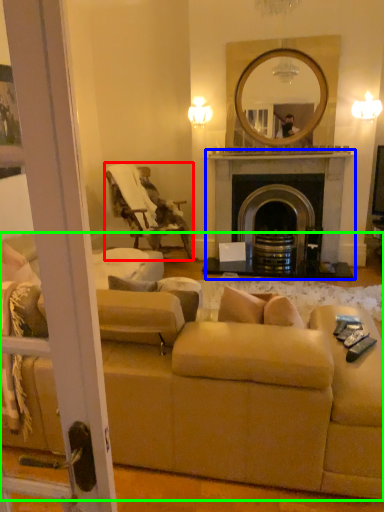
Question: Which object is positioned farthest from chair (highlighted by a red box)? Select from fireplace (highlighted by a blue box) and studio couch (highlighted by a green box).

Choices:
 (A) fireplace
 (B) studio couch

Answer: (B)